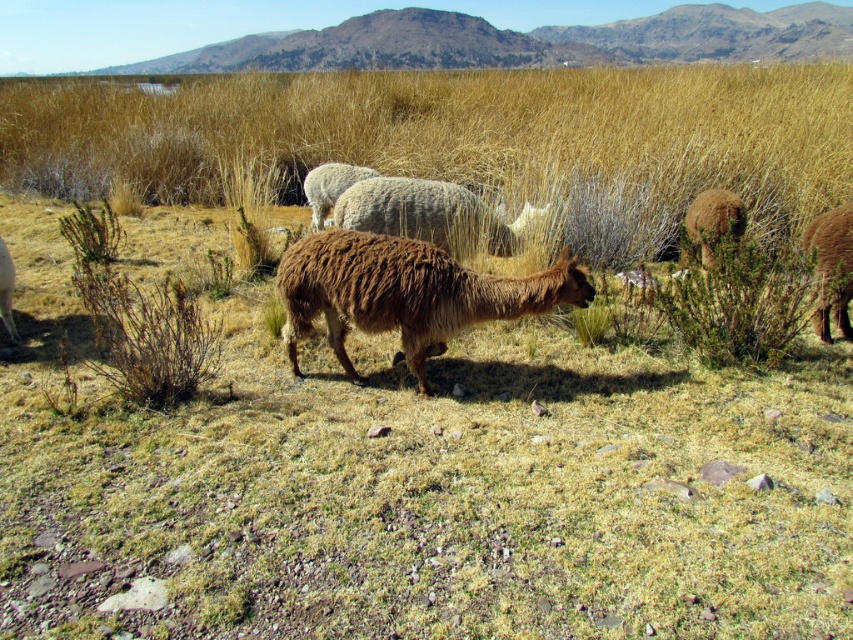
Question: Is fuzzy white sheep at center in front of brown woolly sheep at right?

Choices:
 (A) no
 (B) yes

Answer: (A)

Question: Is brown woolly alpaca at center-right positioned at the back of white woolly sheep at center?

Choices:
 (A) no
 (B) yes

Answer: (A)

Question: Among these points, which one is farthest from the camera?

Choices:
 (A) (3, 316)
 (B) (827, 22)
 (C) (697, 211)

Answer: (B)

Question: Which is farther from the brown woolly alpaca at center-right?

Choices:
 (A) white woolly sheep at center
 (B) brown woolen sheep at lower left
 (C) fuzzy white sheep at center
 (D) brown woolly alpaca at center

Answer: (B)

Question: Among these objects, which one is nearest to the camera?

Choices:
 (A) fuzzy white sheep at center
 (B) brown woolly alpaca at center
 (C) brown woolly alpaca at center-right

Answer: (B)

Question: Does brown woolen alpaca at upper center have a smaller size compared to white woolly sheep at center?

Choices:
 (A) yes
 (B) no

Answer: (B)